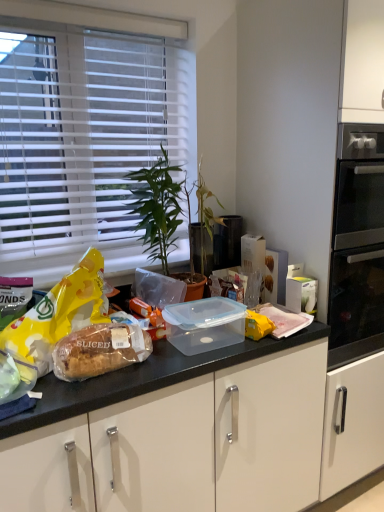
What do you see at coordinates (157, 207) in the screenshot?
I see `green leafy plant at center` at bounding box center [157, 207].

The width and height of the screenshot is (384, 512). What are the coordinates of `black plastic trash can at center` in the screenshot? It's located at (227, 242).

In order to click on sliced bread at center in this screenshot , I will do `click(99, 350)`.

Find the location of a particular element. This screenshot has height=512, width=384. yellow matte snack at left is located at coordinates (59, 314).

Where is `green leafy plant at center`? green leafy plant at center is located at coordinates (157, 207).

Where is `houseplant above the yellow matte snack at left (from the image's perspective)`? The width and height of the screenshot is (384, 512). houseplant above the yellow matte snack at left (from the image's perspective) is located at coordinates (157, 207).

Can you tell me how much yellow matte snack at left and green leafy plant at center differ in facing direction?

yellow matte snack at left and green leafy plant at center are facing 0.00201 degrees away from each other.

From a real-world perspective, is yellow matte snack at left located higher than green leafy plant at center?

No.

Is yellow matte snack at left in contact with green leafy plant at center?

There is a gap between yellow matte snack at left and green leafy plant at center.

Considering their positions, is sliced bread at center located in front of or behind yellow matte snack at left?

sliced bread at center is behind yellow matte snack at left.

Does sliced bread at center have a greater height compared to yellow matte snack at left?

In fact, sliced bread at center may be shorter than yellow matte snack at left.

Based on the photo, could you tell me if sliced bread at center is turned towards yellow matte snack at left?

No, sliced bread at center does not turn towards yellow matte snack at left.

How different are the orientations of sliced bread at center and yellow matte snack at left in degrees?

The angular difference between sliced bread at center and yellow matte snack at left is 6.17 degrees.

From a real-world perspective, is green leafy plant at center positioned above or below sliced bread at center?

From a real-world perspective, green leafy plant at center is physically above sliced bread at center.

Is green leafy plant at center oriented away from sliced bread at center?

No.

Between green leafy plant at center and sliced bread at center, which one has less height?

sliced bread at center is shorter.

Is sliced bread at center completely or partially inside green leafy plant at center?

No, sliced bread at center is not inside green leafy plant at center.

Considering the positions of points (35, 317) and (105, 364), is point (35, 317) closer to camera compared to point (105, 364)?

No, (35, 317) is further to viewer.

Which object is positioned more to the right, yellow matte snack at left or sliced bread at center?

sliced bread at center.

Does yellow matte snack at left have a greater height compared to sliced bread at center?

Yes, yellow matte snack at left is taller than sliced bread at center.

Is yellow matte snack at left situated inside sliced bread at center or outside?

yellow matte snack at left exists outside the volume of sliced bread at center.

Can you confirm if sliced bread at center is smaller than white plastic blinds at upper left?

Yes, sliced bread at center is smaller than white plastic blinds at upper left.

Considering the positions of objects sliced bread at center and white plastic blinds at upper left in the image provided, who is in front, sliced bread at center or white plastic blinds at upper left?

Positioned in front is sliced bread at center.

Could you tell me if sliced bread at center is turned towards white plastic blinds at upper left?

No, sliced bread at center is not facing towards white plastic blinds at upper left.

From the image's perspective, is sliced bread at center located above white plastic blinds at upper left?

No, from the image's perspective, sliced bread at center is not on top of white plastic blinds at upper left.

Locate an element on the screen. Image resolution: width=384 pixels, height=512 pixels. appliance below the green leafy plant at center (from the image's perspective) is located at coordinates (227, 242).

Is green leafy plant at center taller or shorter than black plastic trash can at center?

Considering their sizes, green leafy plant at center has more height than black plastic trash can at center.

Is green leafy plant at center inside or outside of black plastic trash can at center?

green leafy plant at center cannot be found inside black plastic trash can at center.

Between green leafy plant at center and black plastic trash can at center, which one appears on the left side from the viewer's perspective?

green leafy plant at center is more to the left.

Is black plastic trash can at center at the back of white plastic blinds at upper left?

white plastic blinds at upper left does not have its back to black plastic trash can at center.

Image resolution: width=384 pixels, height=512 pixels. Find the location of `appliance below the white plastic blinds at upper left (from the image's perspective)`. appliance below the white plastic blinds at upper left (from the image's perspective) is located at coordinates (227, 242).

Based on their positions, is white plastic blinds at upper left located to the left or right of black plastic trash can at center?

In the image, white plastic blinds at upper left appears on the left side of black plastic trash can at center.

Which object is wider, white plastic blinds at upper left or black plastic trash can at center?

white plastic blinds at upper left.

Locate an element on the screen. snack in front of the green leafy plant at center is located at coordinates tap(59, 314).

Locate an element on the screen. snack on the left of sliced bread at center is located at coordinates (59, 314).

Which object lies nearer to the anchor point yellow matte snack at left, sliced bread at center or black plastic trash can at center?

sliced bread at center is positioned closer to the anchor yellow matte snack at left.

Considering their positions, is black plastic trash can at center positioned further to green leafy plant at center than yellow matte snack at left?

The object further to green leafy plant at center is yellow matte snack at left.

Looking at the image, which one is located closer to black plastic trash can at center, white plastic blinds at upper left or green leafy plant at center?

green leafy plant at center is positioned closer to the anchor black plastic trash can at center.

From the picture: From the image, which object appears to be nearer to sliced bread at center, yellow matte snack at left or green leafy plant at center?

The object closer to sliced bread at center is yellow matte snack at left.

Based on their spatial positions, is white plastic blinds at upper left or yellow matte snack at left closer to black plastic trash can at center?

white plastic blinds at upper left lies closer to black plastic trash can at center than the other object.

When comparing their distances from green leafy plant at center, does white plastic blinds at upper left or yellow matte snack at left seem closer?

Among the two, white plastic blinds at upper left is located nearer to green leafy plant at center.

From the image, which object appears to be farther from sliced bread at center, white plastic blinds at upper left or yellow matte snack at left?

Among the two, white plastic blinds at upper left is located further to sliced bread at center.

From the image, which object appears to be farther from sliced bread at center, black plastic trash can at center or yellow matte snack at left?

The object further to sliced bread at center is black plastic trash can at center.

Where is `appliance between white plastic blinds at upper left and sliced bread at center in the vertical direction`? This screenshot has height=512, width=384. appliance between white plastic blinds at upper left and sliced bread at center in the vertical direction is located at coordinates (227, 242).

The width and height of the screenshot is (384, 512). I want to click on houseplant between white plastic blinds at upper left and yellow matte snack at left from top to bottom, so coord(157,207).

Identify the location of houseplant between white plastic blinds at upper left and black plastic trash can at center in the horizontal direction. (157, 207).

Where is `houseplant that lies between white plastic blinds at upper left and sliced bread at center from top to bottom`? houseplant that lies between white plastic blinds at upper left and sliced bread at center from top to bottom is located at coordinates (157, 207).